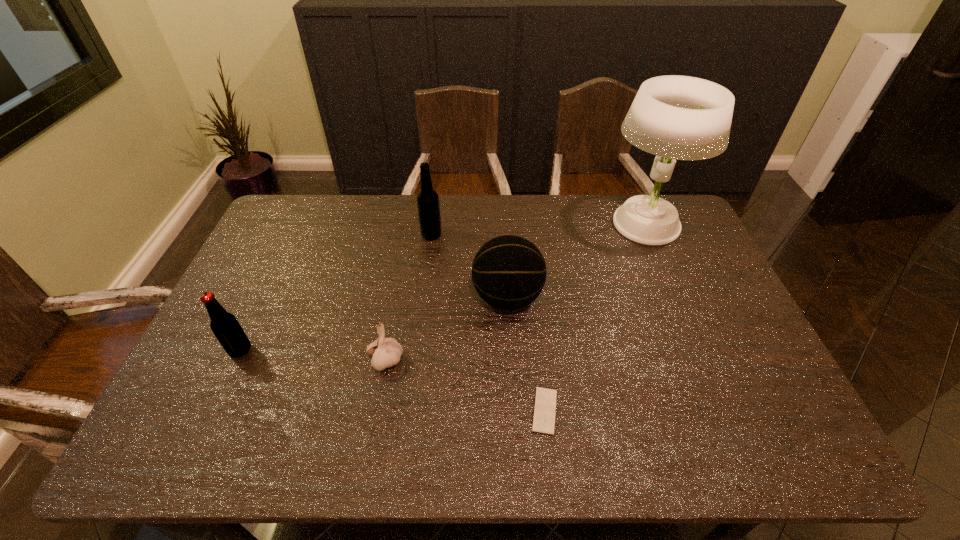
What are the coordinates of `lamp` in the screenshot? It's located at click(674, 117).

The image size is (960, 540). In order to click on the rightmost object in this screenshot , I will do `click(674, 117)`.

Image resolution: width=960 pixels, height=540 pixels. What are the coordinates of `the fifth shortest object` in the screenshot? It's located at (428, 205).

Locate an element on the screen. The image size is (960, 540). the taller beer bottle is located at coordinates (428, 205).

Identify the location of the shorter beer bottle. Image resolution: width=960 pixels, height=540 pixels. (x=225, y=326).

The width and height of the screenshot is (960, 540). What are the coordinates of `the leftmost object` in the screenshot? It's located at (225, 326).

What are the coordinates of `basketball` in the screenshot? It's located at (509, 272).

Where is `garlic`? garlic is located at coordinates (385, 352).

Identify the location of diary. (545, 399).

The height and width of the screenshot is (540, 960). I want to click on the shortest object, so click(545, 399).